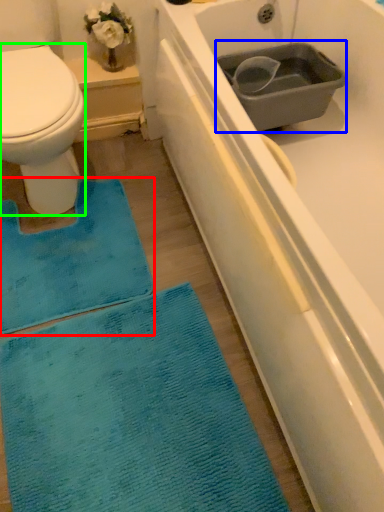
Question: Estimate the real-world distances between objects in this image. Which object is farther from doormat (highlighted by a red box), sink (highlighted by a blue box) or bidet (highlighted by a green box)?

Choices:
 (A) sink
 (B) bidet

Answer: (A)